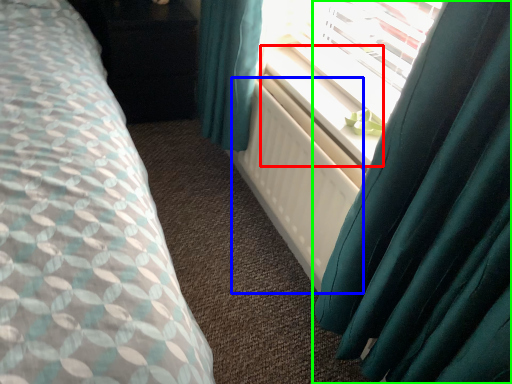
Question: Based on their relative distances, which object is nearer to window sill (highlighted by a red box)? Choose from radiator (highlighted by a blue box) and curtain (highlighted by a green box).

Choices:
 (A) radiator
 (B) curtain

Answer: (A)